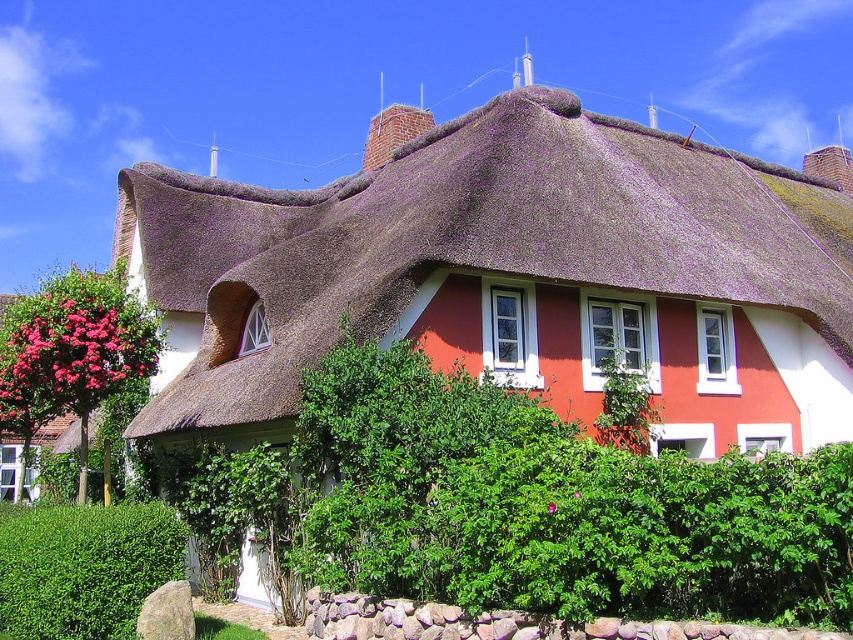
Question: Considering the real-world distances, which object is closest to the pink matte flowers at left?

Choices:
 (A) green leafy hedge at lower left
 (B) pink matte flower at center

Answer: (A)

Question: Which object appears farthest from the camera in this image?

Choices:
 (A) pink matte flower at center
 (B) pink matte flowers at left
 (C) thatched brown roof at upper center

Answer: (B)

Question: Where is thatched brown roof at upper center located in relation to green leafy hedge at lower left in the image?

Choices:
 (A) above
 (B) below

Answer: (A)

Question: Is green leafy hedge at lower left smaller than pink matte flowers at left?

Choices:
 (A) no
 (B) yes

Answer: (A)

Question: Which object is the closest to the thatched brown roof at upper center?

Choices:
 (A) pink matte flowers at left
 (B) pink matte flower at center
 (C) green leafy hedge at lower left

Answer: (C)

Question: Can you confirm if green leafy hedge at lower left is wider than pink matte flower at center?

Choices:
 (A) yes
 (B) no

Answer: (A)